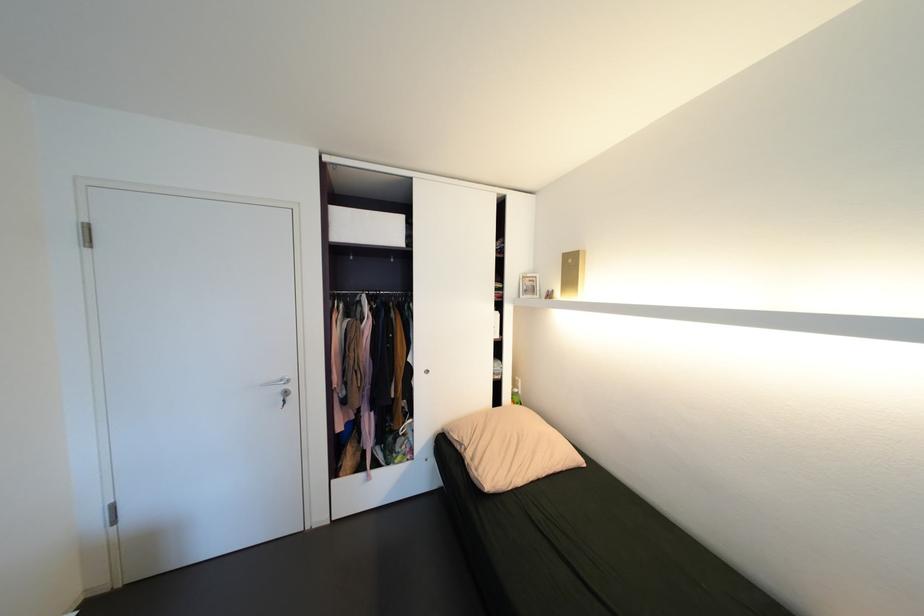
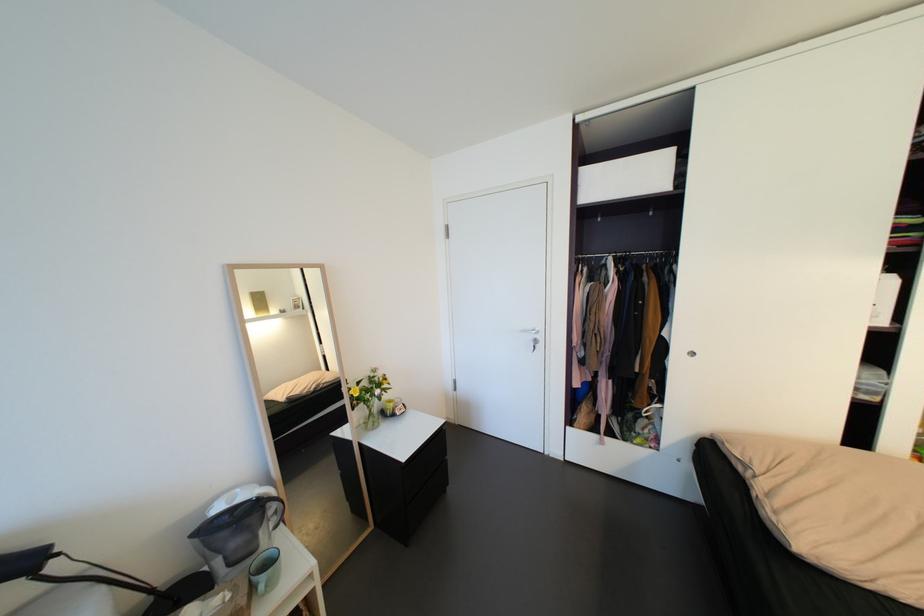
In the second image, find the point that corresponds to point (288, 381) in the first image.

(541, 331)